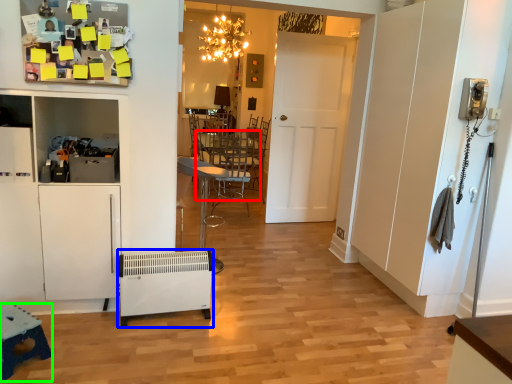
Question: Which is farther away from table (highlighted by a red box)? appliance (highlighted by a blue box) or table (highlighted by a green box)?

Choices:
 (A) appliance
 (B) table

Answer: (B)